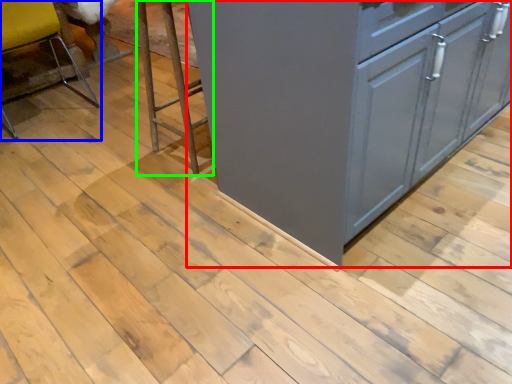
Question: Considering the real-world distances, which object is closest to cabinetry (highlighted by a red box)? chair (highlighted by a blue box) or step stool (highlighted by a green box).

Choices:
 (A) chair
 (B) step stool

Answer: (B)